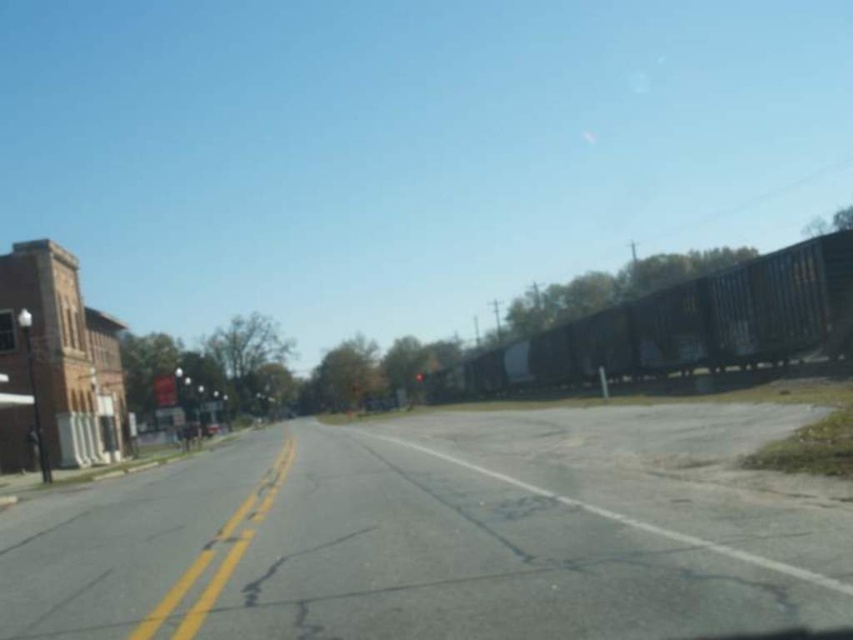
Question: Which point appears farthest from the camera in this image?

Choices:
 (A) (27, 550)
 (B) (595, 369)

Answer: (B)

Question: Does gray asphalt train track at center appear under metallic blue train car at right?

Choices:
 (A) no
 (B) yes

Answer: (B)

Question: Is gray asphalt train track at center in front of metallic blue train car at right?

Choices:
 (A) no
 (B) yes

Answer: (B)

Question: Can you confirm if gray asphalt train track at center is positioned below metallic blue train car at right?

Choices:
 (A) yes
 (B) no

Answer: (A)